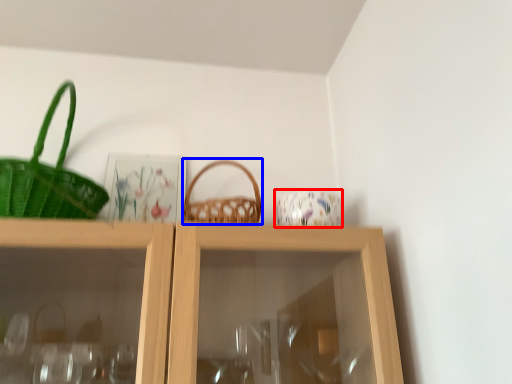
Question: Which point is closer to the camera, tableware (highlighted by a red box) or picnic basket (highlighted by a blue box)?

Choices:
 (A) tableware
 (B) picnic basket

Answer: (B)